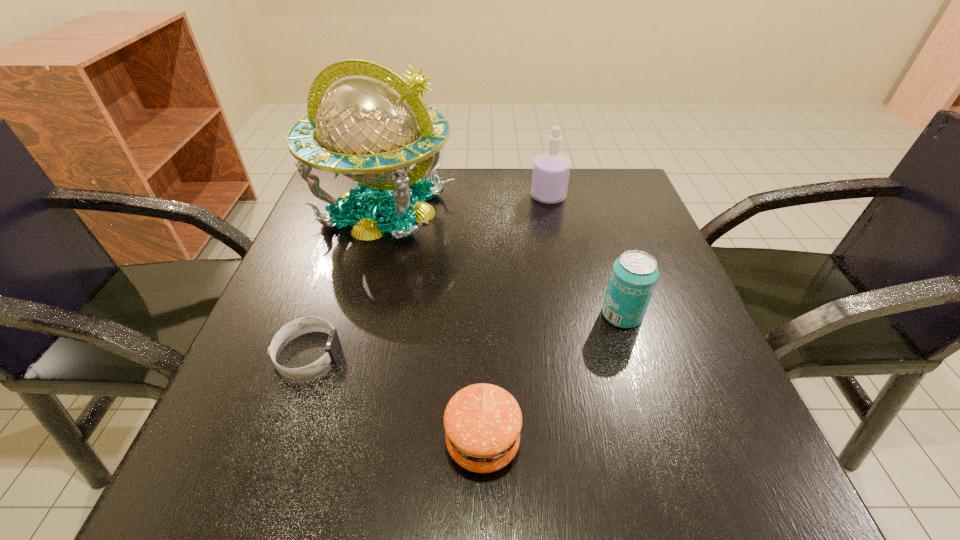
At what (x,y) coordinates should I click in order to perform the action: click on empty space between the wristband and the fourth tallest object. Please return your answer as a coordinate pair (x, y). Looking at the image, I should click on (396, 397).

At what (x,y) coordinates should I click in order to perform the action: click on free space between the shortest object and the patty. Please return your answer as a coordinate pair (x, y). This screenshot has width=960, height=540. Looking at the image, I should click on (396, 397).

Image resolution: width=960 pixels, height=540 pixels. What are the coordinates of `free area in between the third tallest object and the globe` in the screenshot? It's located at (503, 262).

Identify the location of free space between the tallest object and the shortest object. (346, 281).

Locate an element on the screen. This screenshot has width=960, height=540. empty space that is in between the patty and the globe is located at coordinates (433, 325).

Find the location of a particular element. The height and width of the screenshot is (540, 960). empty location between the wristband and the perfume is located at coordinates (428, 275).

Where is `free area in between the third object from left to right and the fourth shortest object`? This screenshot has width=960, height=540. free area in between the third object from left to right and the fourth shortest object is located at coordinates (516, 319).

Locate an element on the screen. The width and height of the screenshot is (960, 540). object that stands as the second closest to the second tallest object is located at coordinates (634, 274).

Where is `object that is the second nearest to the wristband`? This screenshot has height=540, width=960. object that is the second nearest to the wristband is located at coordinates (372, 127).

Where is `free space in the image that satisfies the following two spatial constraints: 1. on the front side of the beer can; 2. on the right side of the fourth object from left to right`? The width and height of the screenshot is (960, 540). free space in the image that satisfies the following two spatial constraints: 1. on the front side of the beer can; 2. on the right side of the fourth object from left to right is located at coordinates (573, 315).